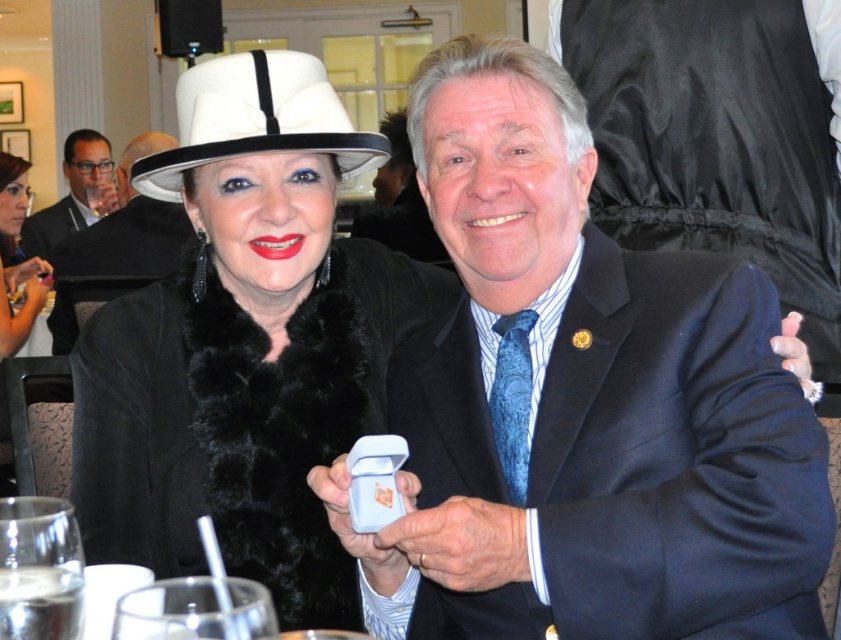
Can you confirm if blue satin suit at center is positioned to the right of matte black hat at upper left?

Correct, you'll find blue satin suit at center to the right of matte black hat at upper left.

Does point (699, 534) come closer to viewer compared to point (122, 260)?

Yes, point (699, 534) is closer to viewer.

Which is in front, point (400, 541) or point (145, 268)?

Point (400, 541)

I want to click on blue satin suit at center, so click(580, 404).

Can you confirm if blue satin suit at center is wider than white felt dress hat at upper left?

Yes.

Between point (586, 579) and point (210, 154), which one is positioned behind?

The point (210, 154) is more distant.

The height and width of the screenshot is (640, 841). I want to click on blue satin suit at center, so click(580, 404).

Is white fur coat at center closer to the viewer compared to matte black hat at upper left?

Yes, it is.

Who is positioned more to the left, white fur coat at center or matte black hat at upper left?

Positioned to the left is matte black hat at upper left.

Which is behind, point (201, 193) or point (133, 227)?

The point (133, 227) is more distant.

This screenshot has width=841, height=640. What are the coordinates of `white fur coat at center` in the screenshot? It's located at (246, 344).